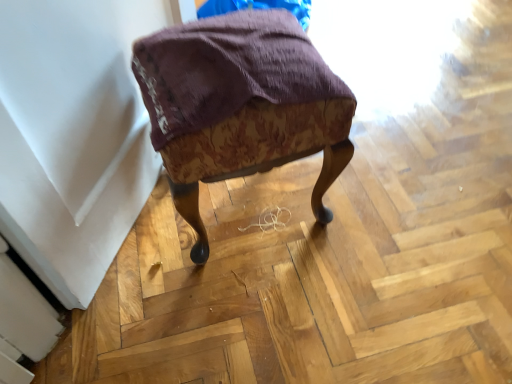
You are a GUI agent. You are given a task and a screenshot of the screen. Output one action in this format:
    pyautogui.click(x=<x>, y=<y>)
    Task: Click on the free space in front of patterned fabric stool at center
    The width and height of the screenshot is (512, 384).
    Given the screenshot: What is the action you would take?
    pyautogui.click(x=253, y=310)